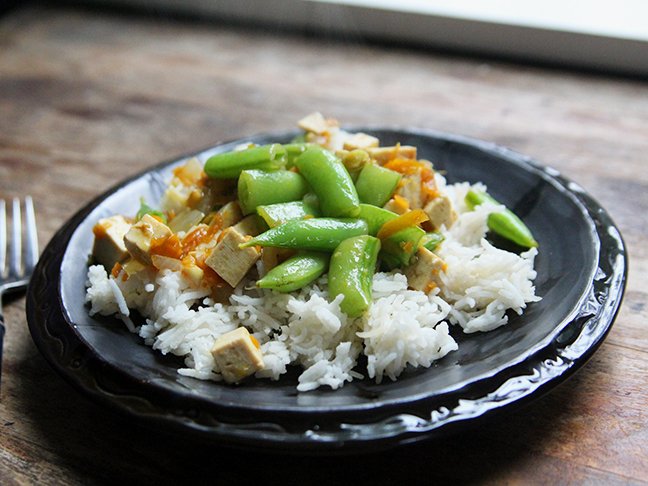
Locate an element on the screen. This screenshot has height=486, width=648. wooden table surface is located at coordinates (41, 415), (47, 459), (570, 449), (631, 180), (375, 77), (183, 70), (93, 100), (27, 54), (45, 161).